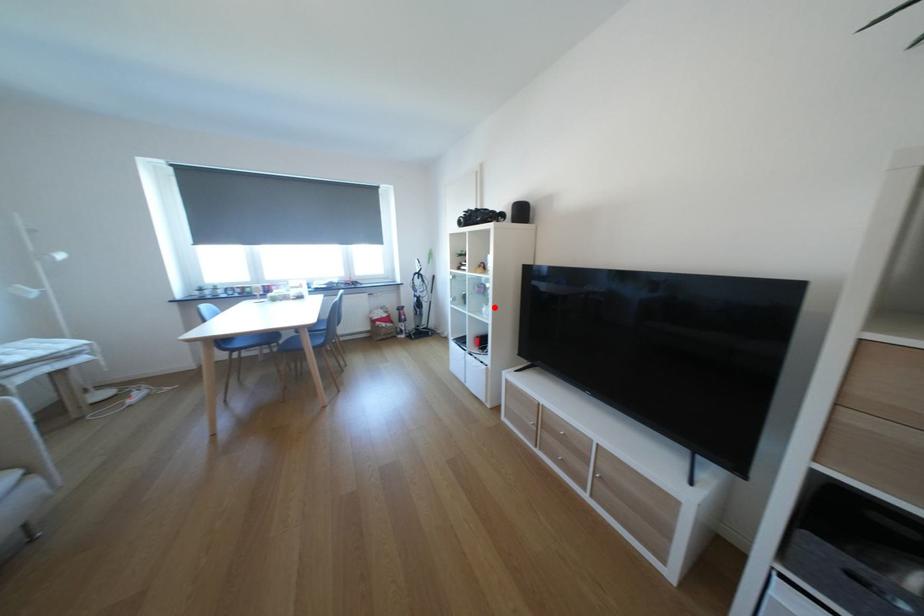
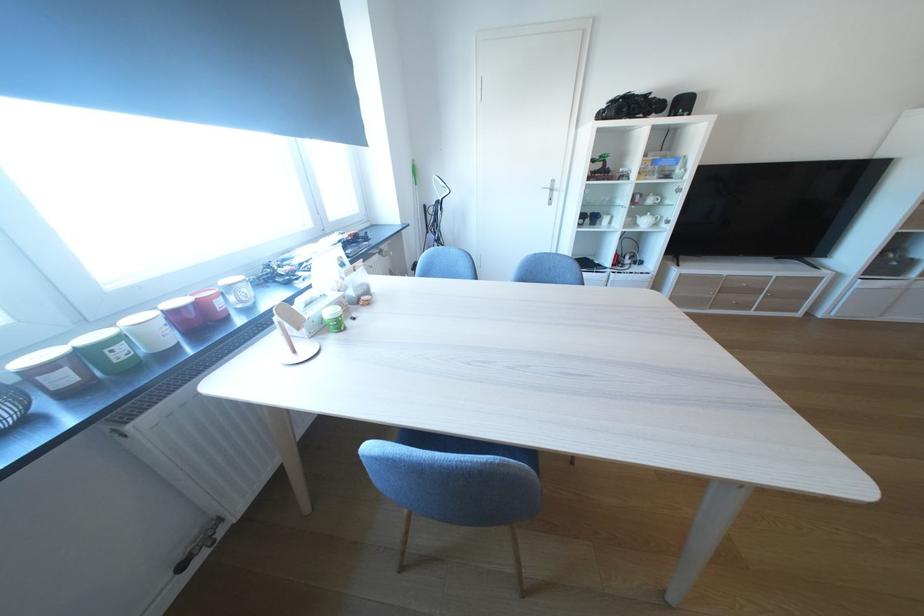
Question: I am providing you with two images of the same scene from different viewpoints. Image1 has a red point marked. In image2, the corresponding 3D location appears at what relative position? Reply with the corresponding letter.

Choices:
 (A) Closer
 (B) Farther

Answer: (A)